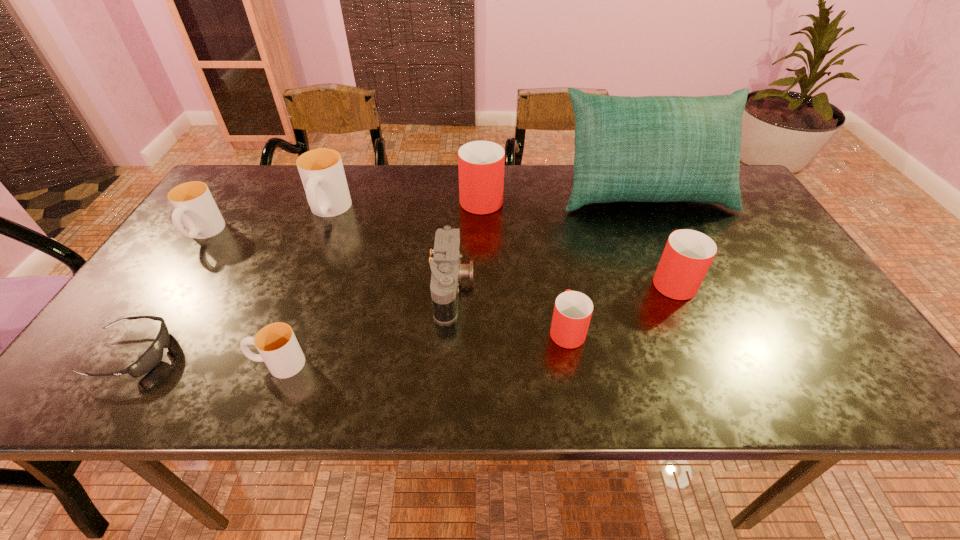
At what (x,y) coordinates should I click in order to perform the action: click on free space that satisfies the following two spatial constraints: 1. with the handle on the side of the nearest yellow cup; 2. on the side of the biggest red cup with the handle. Please return your answer as a coordinate pair (x, y). Looking at the image, I should click on (342, 197).

Where is `vacant space that satisfies the following two spatial constraints: 1. with the handle on the side of the leftmost cup; 2. with the handle on the side of the smallest yellow cup`? The width and height of the screenshot is (960, 540). vacant space that satisfies the following two spatial constraints: 1. with the handle on the side of the leftmost cup; 2. with the handle on the side of the smallest yellow cup is located at coordinates (113, 364).

I want to click on vacant region that satisfies the following two spatial constraints: 1. on the lens of the camera; 2. on the side of the smallest red cup with the handle, so click(x=450, y=329).

At what (x,y) coordinates should I click in order to perform the action: click on free space that satisfies the following two spatial constraints: 1. on the front-facing side of the cushion; 2. on the lenses of the goggles. Please return your answer as a coordinate pair (x, y). This screenshot has width=960, height=540. Looking at the image, I should click on (718, 354).